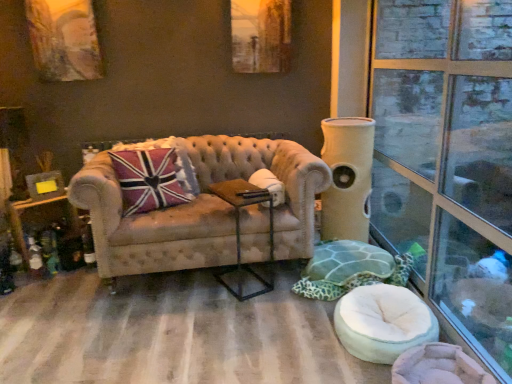
Where is `vacant space situated on the left part of metallic brown side table at center`? vacant space situated on the left part of metallic brown side table at center is located at coordinates (200, 285).